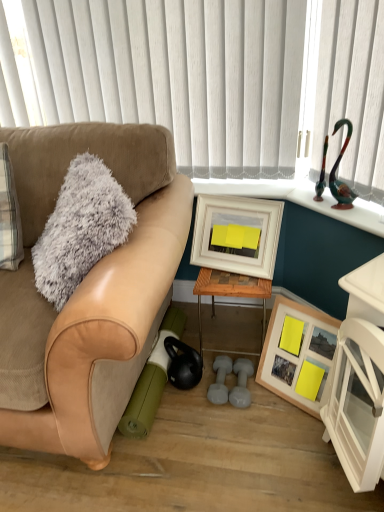
Find the location of `vacant space in front of white wooden picture frame at center, the 1th picture frame positioned from the top`. vacant space in front of white wooden picture frame at center, the 1th picture frame positioned from the top is located at coordinates (239, 282).